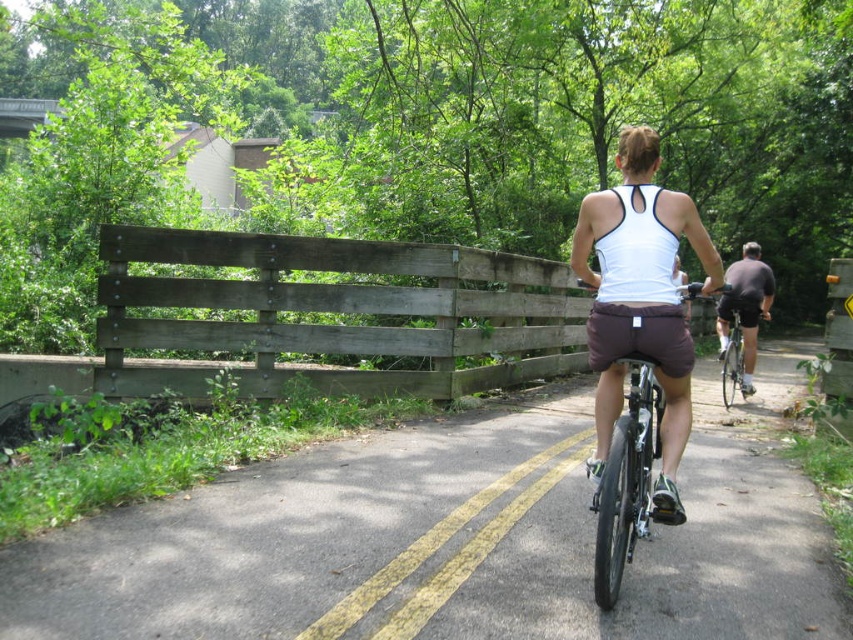
Which of these two, asphalt road at center or shiny metallic bicycle at center, stands shorter?

asphalt road at center is shorter.

In the scene shown: Between asphalt road at center and shiny metallic bicycle at center, which one appears on the right side from the viewer's perspective?

asphalt road at center is more to the right.

At what (x,y) coordinates should I click in order to perform the action: click on asphalt road at center. Please return your answer as a coordinate pair (x, y). Image resolution: width=853 pixels, height=640 pixels. Looking at the image, I should click on (451, 540).

This screenshot has width=853, height=640. Find the location of `asphalt road at center`. asphalt road at center is located at coordinates (451, 540).

Does shiny metallic bicycle at center lie in front of dark gray fabric shorts at right?

Yes, shiny metallic bicycle at center is in front of dark gray fabric shorts at right.

Does shiny metallic bicycle at center appear over dark gray fabric shorts at right?

No, shiny metallic bicycle at center is not above dark gray fabric shorts at right.

Find the location of a particular element. Image resolution: width=853 pixels, height=640 pixels. shiny metallic bicycle at center is located at coordinates (628, 480).

Does white fabric tank top at center have a greater height compared to shiny metallic bicycle at center?

Yes, white fabric tank top at center is taller than shiny metallic bicycle at center.

Image resolution: width=853 pixels, height=640 pixels. Find the location of `white fabric tank top at center`. white fabric tank top at center is located at coordinates (640, 300).